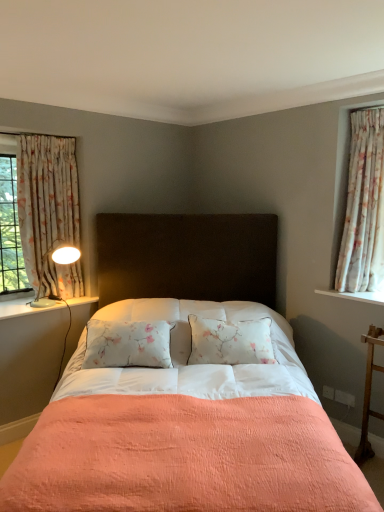
Question: Is peachy fabric bed at center beside floral fabric curtain at left, which appears as the 1th curtain when viewed from the left?

Choices:
 (A) no
 (B) yes

Answer: (A)

Question: Is peachy fabric bed at center far from floral fabric curtain at left, which appears as the 1th curtain when viewed from the left?

Choices:
 (A) yes
 (B) no

Answer: (B)

Question: Does peachy fabric bed at center turn towards floral fabric curtain at left, the second curtain in the right-to-left sequence?

Choices:
 (A) no
 (B) yes

Answer: (A)

Question: Does peachy fabric bed at center appear on the left side of floral fabric curtain at left, which appears as the 1th curtain when viewed from the left?

Choices:
 (A) yes
 (B) no

Answer: (B)

Question: Is peachy fabric bed at center completely or partially outside of floral fabric curtain at left, the second curtain in the right-to-left sequence?

Choices:
 (A) no
 (B) yes

Answer: (B)

Question: Does peachy fabric bed at center come in front of floral fabric curtain at left, the second curtain in the right-to-left sequence?

Choices:
 (A) no
 (B) yes

Answer: (B)

Question: From the image's perspective, would you say white glossy lamp at left is positioned over white painted wood at left?

Choices:
 (A) no
 (B) yes

Answer: (B)

Question: From a real-world perspective, is white glossy lamp at left positioned over white painted wood at left based on gravity?

Choices:
 (A) no
 (B) yes

Answer: (B)

Question: Is white glossy lamp at left positioned before white painted wood at left?

Choices:
 (A) no
 (B) yes

Answer: (A)

Question: Is white glossy lamp at left surrounding white painted wood at left?

Choices:
 (A) yes
 (B) no

Answer: (B)

Question: Is white glossy lamp at left oriented towards white painted wood at left?

Choices:
 (A) yes
 (B) no

Answer: (B)

Question: Is white glossy lamp at left taller than white painted wood at left?

Choices:
 (A) no
 (B) yes

Answer: (B)

Question: From a real-world perspective, is white glossy lamp at left physically above floral fabric curtain at right, the 1th curtain viewed from the right?

Choices:
 (A) yes
 (B) no

Answer: (B)